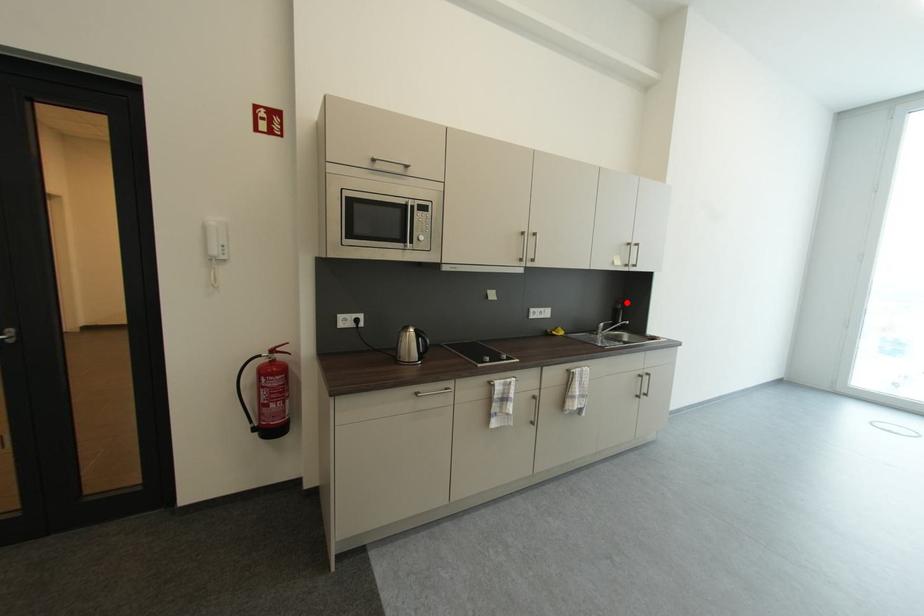
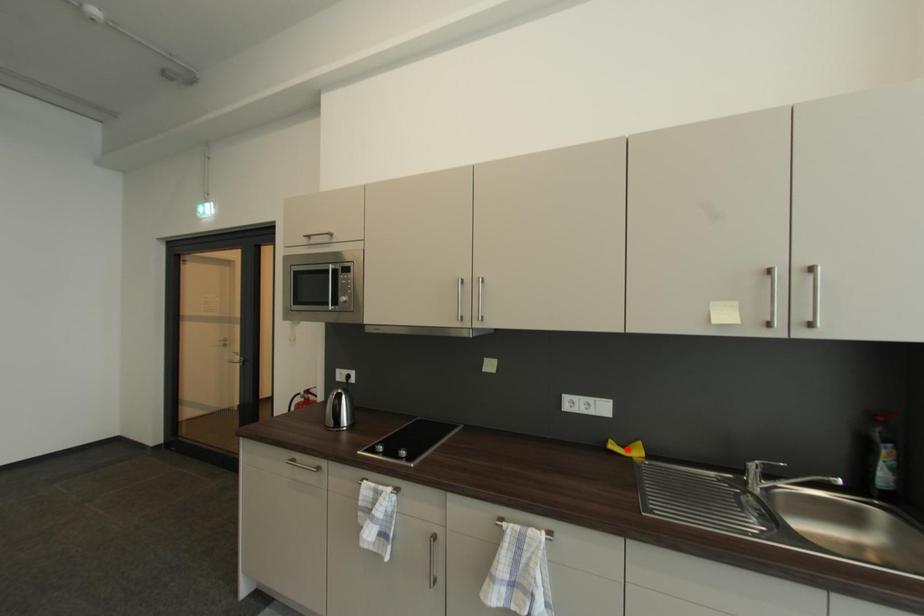
I am providing you with two images of the same scene from different viewpoints. A red point is marked on the first image and another point is marked on the second image. Are the points marked in image1 and image2 representing the same 3D position?

No